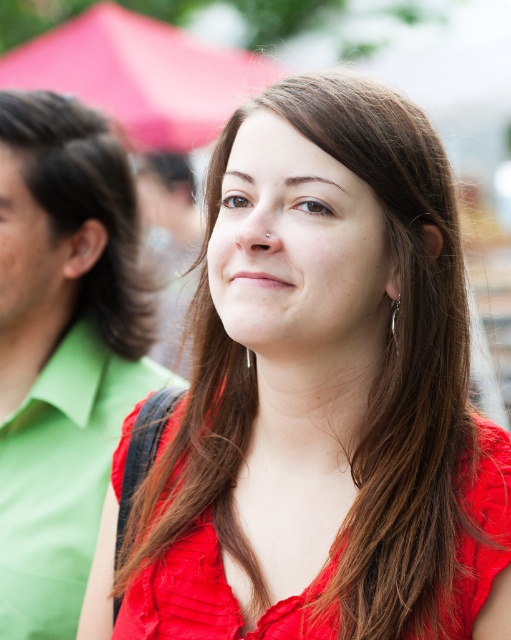
You are a photographer at an outdoor event. You want to capture a photo where the matte red dress at center is visible above the silver metallic earring at right. Is this possible based on their current positions?

The matte red dress at center is currently below the silver metallic earring at right, so it would not be possible to capture the matte red dress at center above the silver metallic earring at right in this position.

What are the coordinates of the matte red dress at center?

The coordinates of the matte red dress at center are at point (218, 595).

What is the color of the clothing item located at the coordinates point (218,595) in the image?

The point (218,595) indicates a matte red dress at center.